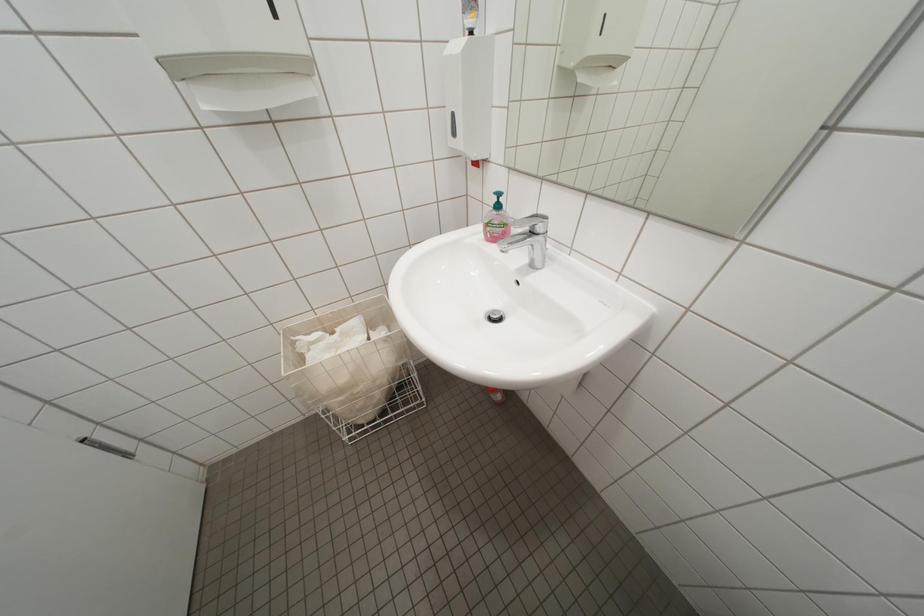
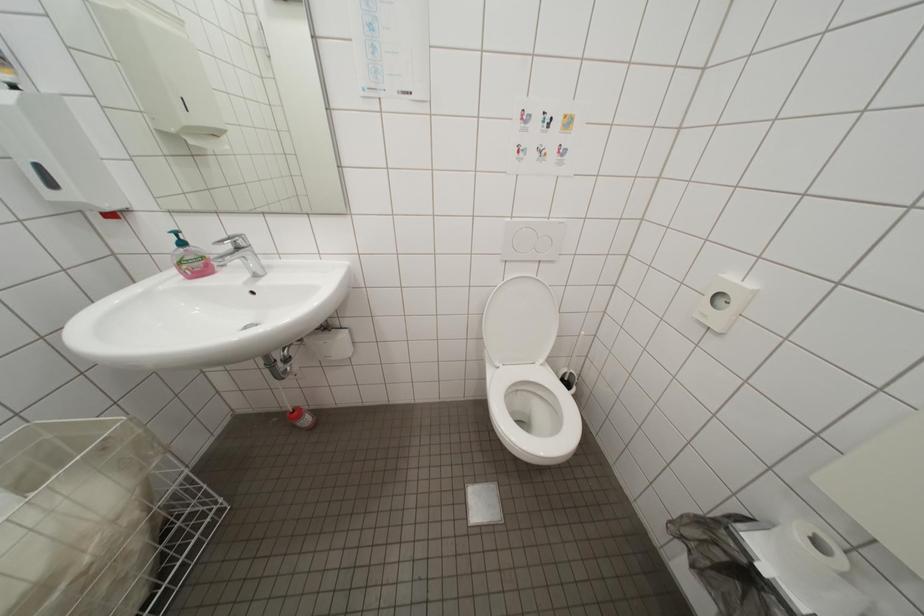
Question: The camera is either moving clockwise (left) or counter-clockwise (right) around the object. The first image is from the beginning of the video and the second image is from the end. Is the camera moving left or right when shooting the video?

Choices:
 (A) Left
 (B) Right

Answer: (A)